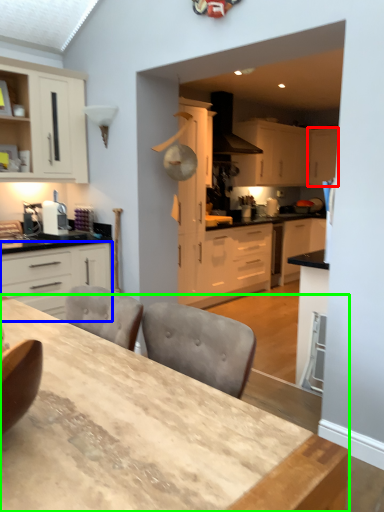
Question: Estimate the real-world distances between objects in this image. Which object is closer to cabinetry (highlighted by a red box), cabinetry (highlighted by a blue box) or table (highlighted by a green box)?

Choices:
 (A) cabinetry
 (B) table

Answer: (A)